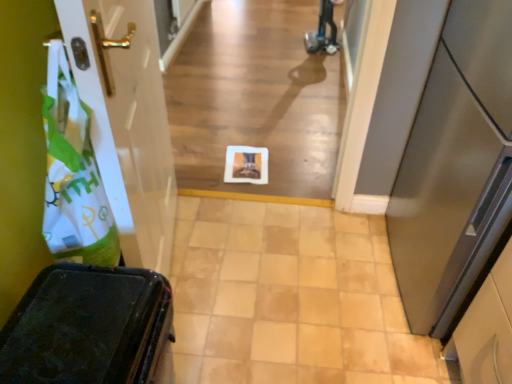
Question: From the image's perspective, is beige tile floor at center positioned above or below white matte plastic bag at left?

Choices:
 (A) above
 (B) below

Answer: (B)

Question: Visually, is beige tile floor at center positioned to the left or to the right of white matte plastic bag at left?

Choices:
 (A) right
 (B) left

Answer: (A)

Question: Which of these objects is positioned closest to the beige tile floor at center?

Choices:
 (A) white matte plastic bag at left
 (B) white glossy door at left, placed as the 1th door when sorted from left to right
 (C) matte black suitcase at lower left
 (D) white paper at center
 (E) satin silver door at right, arranged as the first door when viewed from the right

Answer: (E)

Question: Which is farther from the beige tile floor at center?

Choices:
 (A) satin silver door at right, which is counted as the second door, starting from the left
 (B) white matte plastic bag at left
 (C) white paper at center
 (D) white glossy door at left, placed as the 1th door when sorted from left to right
 (E) matte black suitcase at lower left

Answer: (C)